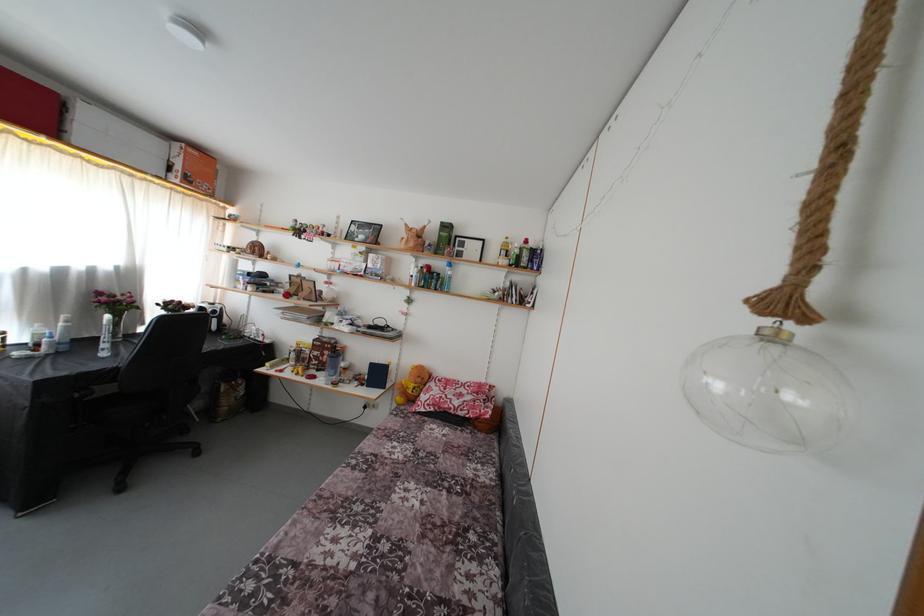
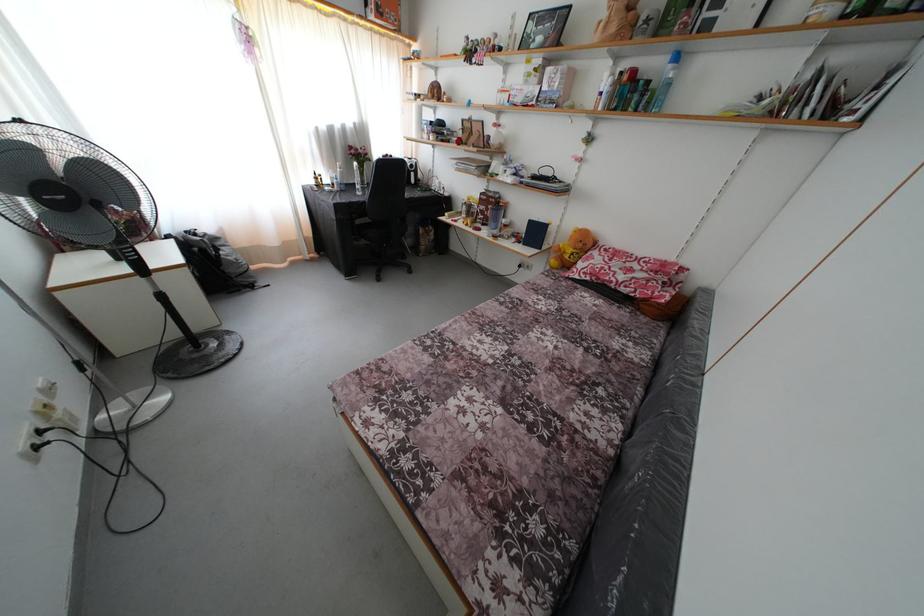
The point at (x=323, y=376) is marked in the first image. Where is the corresponding point in the second image?

(488, 230)